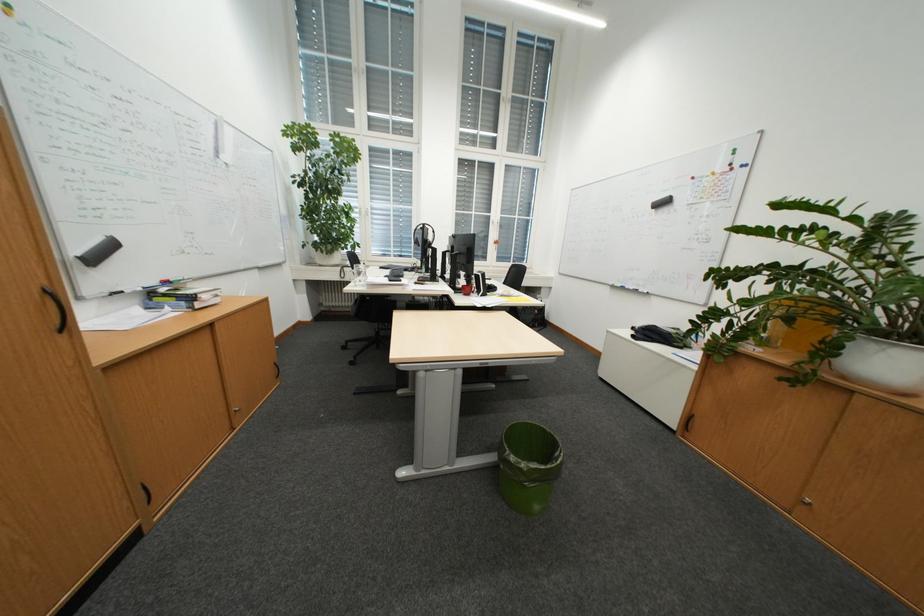
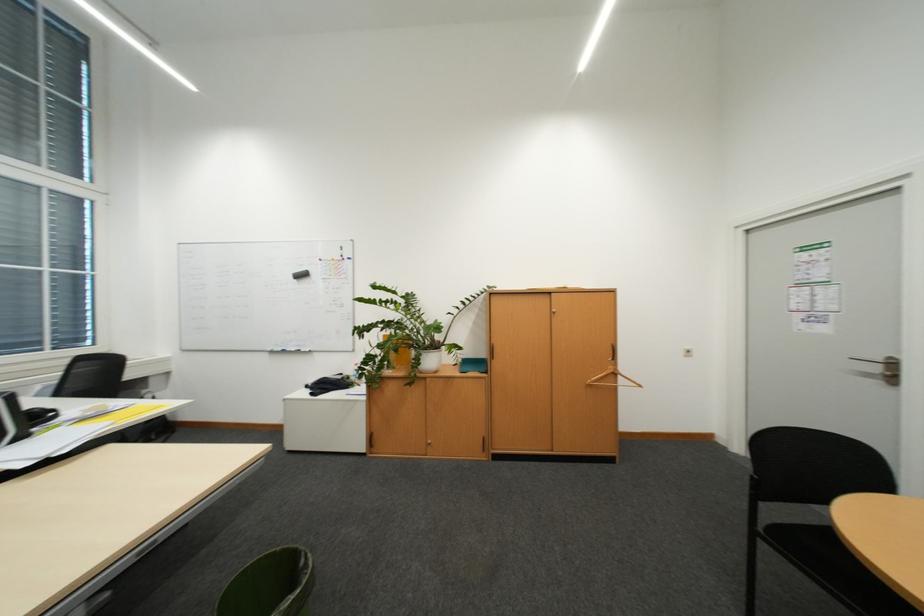
Question: The first image is from the beginning of the video and the second image is from the end. How did the camera likely rotate when shooting the video?

Choices:
 (A) Left
 (B) Right
 (C) Up
 (D) Down

Answer: (B)